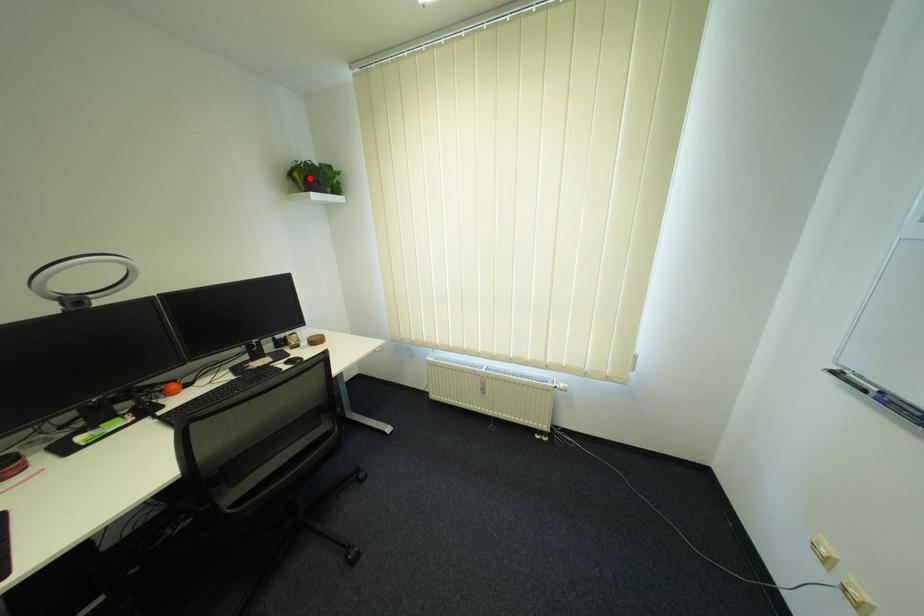
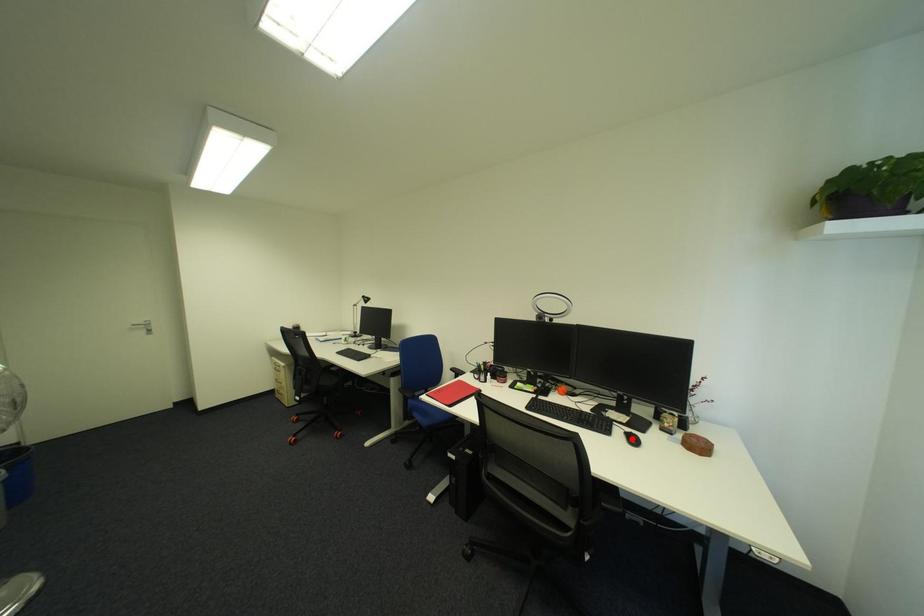
I am providing you with two images of the same scene from different viewpoints. A red point is marked on the first image and another point is marked on the second image. Does the point marked in image1 correspond to the same location as the one in image2?

No